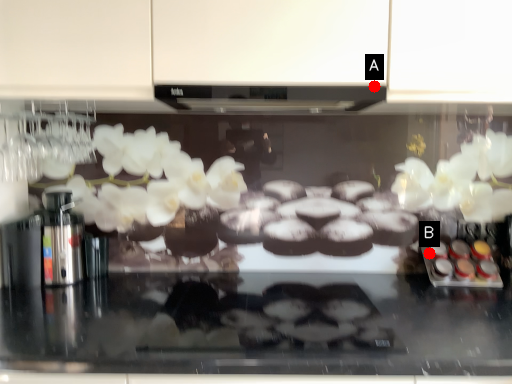
Question: Two points are circled on the image, labeled by A and B beside each circle. Which point appears closest to the camera in this image?

Choices:
 (A) A is closer
 (B) B is closer

Answer: (A)